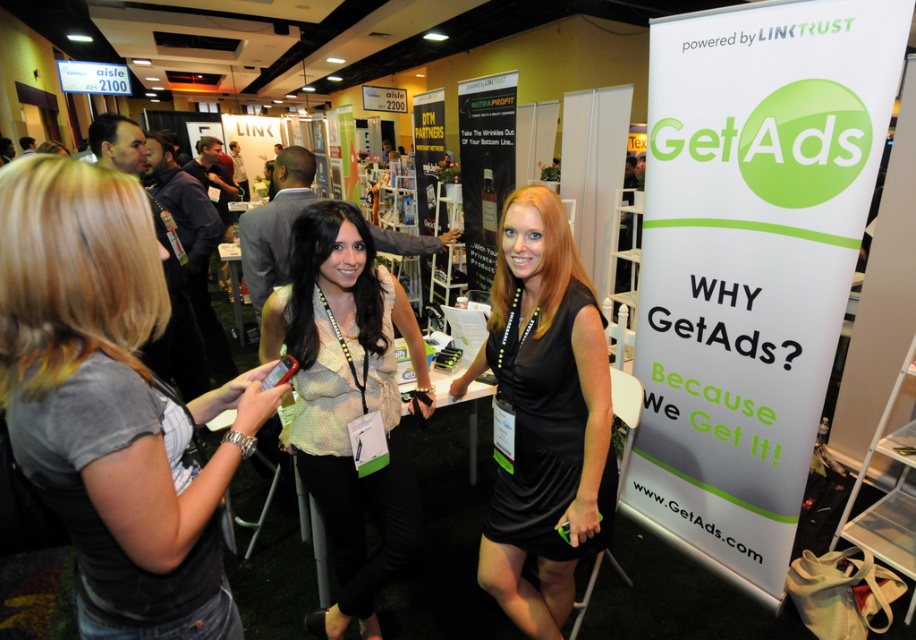
Does white paper banner at right have a smaller size compared to gray fabric shirt at left?

No.

Can you confirm if white paper banner at right is bigger than gray fabric shirt at left?

Indeed, white paper banner at right has a larger size compared to gray fabric shirt at left.

Is point (705, 97) closer to viewer compared to point (41, 342)?

No, (705, 97) is behind (41, 342).

This screenshot has height=640, width=916. I want to click on white paper banner at right, so click(750, 262).

Can you confirm if white paper banner at right is smaller than light beige sheer blouse at center?

Actually, white paper banner at right might be larger than light beige sheer blouse at center.

At what (x,y) coordinates should I click in order to perform the action: click on white paper banner at right. Please return your answer as a coordinate pair (x, y). This screenshot has width=916, height=640. Looking at the image, I should click on (750, 262).

At what (x,y) coordinates should I click in order to perform the action: click on white paper banner at right. Please return your answer as a coordinate pair (x, y). The height and width of the screenshot is (640, 916). Looking at the image, I should click on (750, 262).

Between white paper banner at right and black satin dress at center, which one has more height?

white paper banner at right is taller.

Find the location of `white paper banner at right`. white paper banner at right is located at coordinates tap(750, 262).